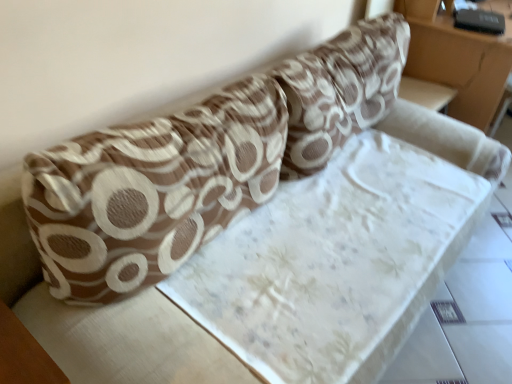
Where is `brown textured pillow at upper center, which is the first throw pillow in left-to-right order`? The image size is (512, 384). brown textured pillow at upper center, which is the first throw pillow in left-to-right order is located at coordinates (151, 190).

This screenshot has width=512, height=384. Describe the element at coordinates (24, 354) in the screenshot. I see `white fabric table at lower left` at that location.

This screenshot has height=384, width=512. Describe the element at coordinates (458, 60) in the screenshot. I see `floral fabric mattress at upper right` at that location.

The width and height of the screenshot is (512, 384). Identify the location of brown textured pillow at upper center, which is the first throw pillow in left-to-right order. (151, 190).

Looking at their sizes, would you say white fabric table at lower left is wider or thinner than brown textured pillow at upper center, which is the first throw pillow in left-to-right order?

Clearly, white fabric table at lower left has less width compared to brown textured pillow at upper center, which is the first throw pillow in left-to-right order.

Is white fabric table at lower left situated inside brown textured pillow at upper center, the 2th throw pillow positioned from the right, or outside?

white fabric table at lower left is not inside brown textured pillow at upper center, the 2th throw pillow positioned from the right, it's outside.

What's the angular difference between white fabric table at lower left and brown textured pillow at upper center, which is the first throw pillow in left-to-right order,'s facing directions?

The facing directions of white fabric table at lower left and brown textured pillow at upper center, which is the first throw pillow in left-to-right order, are 91.1 degrees apart.

Is white fabric table at lower left facing away from brown textured pillow at upper center, the 2th throw pillow positioned from the right?

No, brown textured pillow at upper center, the 2th throw pillow positioned from the right, is not at the back of white fabric table at lower left.

Can we say brown textured pillow at upper center, which is the first throw pillow in left-to-right order, lies outside floral fabric mattress at upper right?

Absolutely, brown textured pillow at upper center, which is the first throw pillow in left-to-right order, is external to floral fabric mattress at upper right.

Is brown textured pillow at upper center, the 2th throw pillow positioned from the right, wider than floral fabric mattress at upper right?

No.

This screenshot has width=512, height=384. Identify the location of the 1st throw pillow below when counting from the floral fabric mattress at upper right (from the image's perspective). (340, 90).

Based on the photo, could you tell me if brown textured pillow at upper center, the 2th throw pillow positioned from the left, is turned towards floral fabric mattress at upper right?

No.

Which of these two, floral fabric mattress at upper right or brown textured pillow at upper center, the 2th throw pillow positioned from the left, stands taller?

With more height is floral fabric mattress at upper right.

In the image, is floral fabric mattress at upper right positioned in front of or behind brown textured pillow at upper center, placed as the first throw pillow when sorted from right to left?

Clearly, floral fabric mattress at upper right is behind brown textured pillow at upper center, placed as the first throw pillow when sorted from right to left.

Is floral fabric mattress at upper right located outside brown textured pillow at upper center, placed as the first throw pillow when sorted from right to left?

Yes.

From a real-world perspective, is white fabric table at lower left physically located above or below brown textured pillow at upper center, the 2th throw pillow positioned from the left?

white fabric table at lower left is below brown textured pillow at upper center, the 2th throw pillow positioned from the left.

Can you confirm if white fabric table at lower left is taller than brown textured pillow at upper center, the 2th throw pillow positioned from the left?

Incorrect, the height of white fabric table at lower left is not larger of that of brown textured pillow at upper center, the 2th throw pillow positioned from the left.

Is white fabric table at lower left at the right side of brown textured pillow at upper center, the 2th throw pillow positioned from the left?

No.

Is floral fabric mattress at upper right in front of or behind white fabric table at lower left in the image?

Clearly, floral fabric mattress at upper right is behind white fabric table at lower left.

From the image's perspective, does floral fabric mattress at upper right appear higher than white fabric table at lower left?

Yes.

Considering the sizes of floral fabric mattress at upper right and white fabric table at lower left in the image, is floral fabric mattress at upper right wider or thinner than white fabric table at lower left?

In the image, floral fabric mattress at upper right appears to be wider than white fabric table at lower left.

Does floral fabric mattress at upper right appear on the right side of white fabric table at lower left?

Yes.

Considering the sizes of white fabric table at lower left and floral fabric mattress at upper right in the image, is white fabric table at lower left taller or shorter than floral fabric mattress at upper right?

Clearly, white fabric table at lower left is shorter compared to floral fabric mattress at upper right.

Is white fabric table at lower left not near floral fabric mattress at upper right?

white fabric table at lower left is far away from floral fabric mattress at upper right.

Does white fabric table at lower left turn towards floral fabric mattress at upper right?

Yes, white fabric table at lower left is aimed at floral fabric mattress at upper right.

The image size is (512, 384). In order to click on the 1st throw pillow positioned above the white fabric table at lower left (from a real-world perspective) in this screenshot , I will do 151,190.

Starting from the floral fabric mattress at upper right, which throw pillow is the 2nd one to the left? Please provide its 2D coordinates.

[(151, 190)]

Estimate the real-world distances between objects in this image. Which object is closer to brown textured pillow at upper center, placed as the first throw pillow when sorted from right to left, floral fabric mattress at upper right or brown textured pillow at upper center, the 2th throw pillow positioned from the right?

brown textured pillow at upper center, the 2th throw pillow positioned from the right, is closer to brown textured pillow at upper center, placed as the first throw pillow when sorted from right to left.

Estimate the real-world distances between objects in this image. Which object is further from white fabric table at lower left, brown textured pillow at upper center, the 2th throw pillow positioned from the right, or brown textured pillow at upper center, the 2th throw pillow positioned from the left?

brown textured pillow at upper center, the 2th throw pillow positioned from the left, is positioned further to the anchor white fabric table at lower left.

From the image, which object appears to be farther from brown textured pillow at upper center, which is the first throw pillow in left-to-right order, brown textured pillow at upper center, the 2th throw pillow positioned from the left, or floral fabric mattress at upper right?

Among the two, floral fabric mattress at upper right is located further to brown textured pillow at upper center, which is the first throw pillow in left-to-right order.

In the scene shown: Estimate the real-world distances between objects in this image. Which object is closer to white fabric table at lower left, brown textured pillow at upper center, the 2th throw pillow positioned from the left, or floral fabric mattress at upper right?

Based on the image, brown textured pillow at upper center, the 2th throw pillow positioned from the left, appears to be nearer to white fabric table at lower left.

Looking at the image, which one is located closer to white fabric table at lower left, floral fabric mattress at upper right or brown textured pillow at upper center, the 2th throw pillow positioned from the left?

brown textured pillow at upper center, the 2th throw pillow positioned from the left, is closer to white fabric table at lower left.

Estimate the real-world distances between objects in this image. Which object is closer to floral fabric mattress at upper right, brown textured pillow at upper center, the 2th throw pillow positioned from the left, or brown textured pillow at upper center, the 2th throw pillow positioned from the right?

The object closer to floral fabric mattress at upper right is brown textured pillow at upper center, the 2th throw pillow positioned from the left.

Looking at the image, which one is located further to floral fabric mattress at upper right, white fabric table at lower left or brown textured pillow at upper center, the 2th throw pillow positioned from the left?

Among the two, white fabric table at lower left is located further to floral fabric mattress at upper right.

Based on their spatial positions, is brown textured pillow at upper center, placed as the first throw pillow when sorted from right to left, or white fabric table at lower left further from brown textured pillow at upper center, which is the first throw pillow in left-to-right order?

brown textured pillow at upper center, placed as the first throw pillow when sorted from right to left.

Image resolution: width=512 pixels, height=384 pixels. I want to click on throw pillow between brown textured pillow at upper center, the 2th throw pillow positioned from the right, and floral fabric mattress at upper right, so click(x=340, y=90).

Find the location of a particular element. This screenshot has height=384, width=512. throw pillow located between white fabric table at lower left and brown textured pillow at upper center, placed as the first throw pillow when sorted from right to left, in the left-right direction is located at coordinates (151, 190).